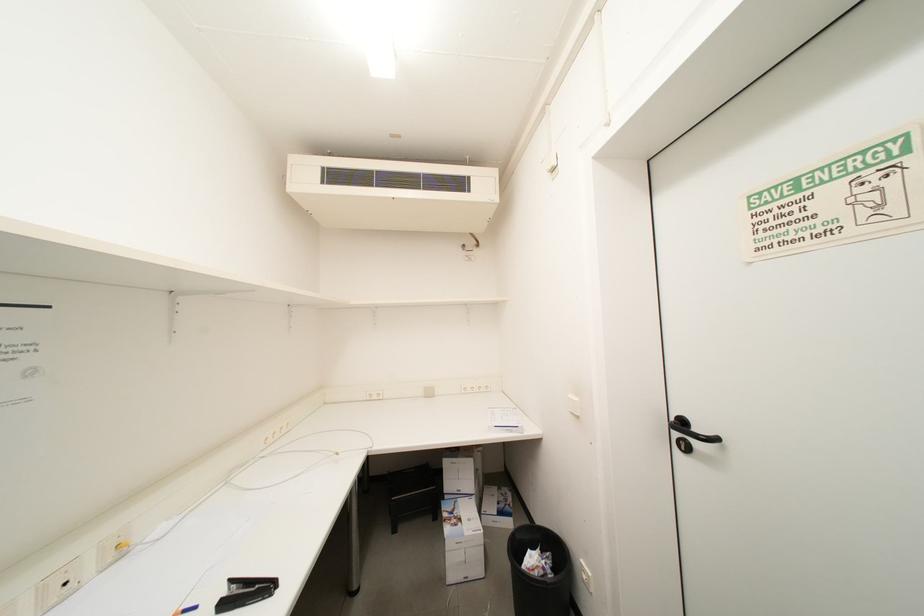
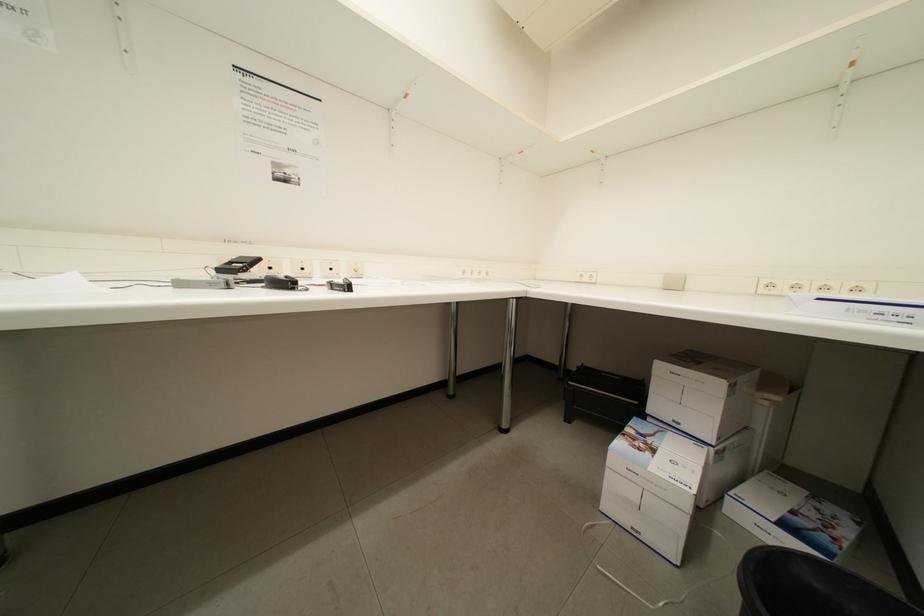
Question: How did the camera likely rotate?

Choices:
 (A) Left
 (B) Right
 (C) Up
 (D) Down

Answer: (A)